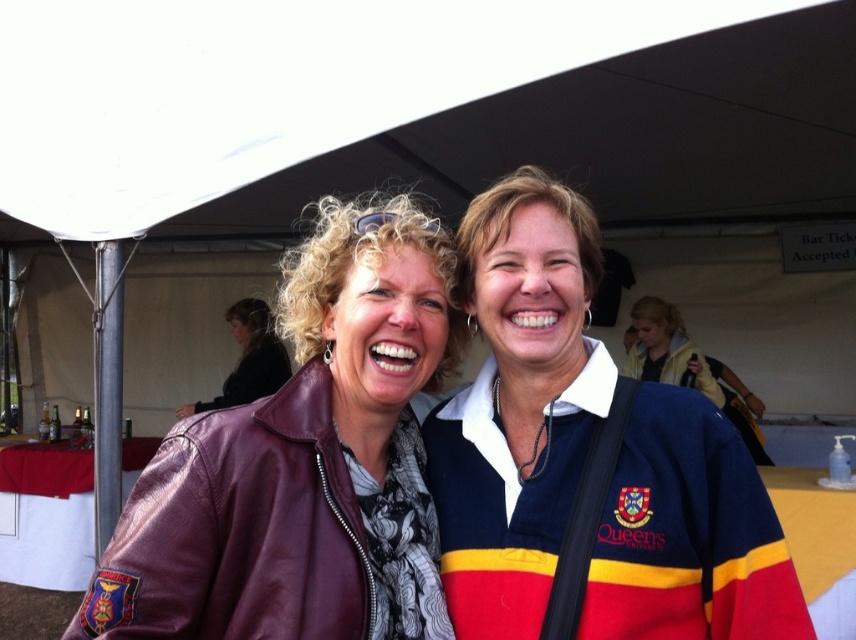
Can you confirm if navy blue jersey at center is thinner than matte leather jacket at center?

In fact, navy blue jersey at center might be wider than matte leather jacket at center.

Describe the element at coordinates (587, 461) in the screenshot. This screenshot has height=640, width=856. I see `navy blue jersey at center` at that location.

Locate an element on the screen. The width and height of the screenshot is (856, 640). navy blue jersey at center is located at coordinates (587, 461).

Is white fabric canopy at upper center to the left of dark brown leather jacket at center from the viewer's perspective?

In fact, white fabric canopy at upper center is to the right of dark brown leather jacket at center.

Is white fabric canopy at upper center positioned in front of dark brown leather jacket at center?

Yes, it is in front of dark brown leather jacket at center.

Between point (657, 54) and point (271, 369), which one is positioned in front?

Positioned in front is point (657, 54).

Find the location of a particular element. The width and height of the screenshot is (856, 640). white fabric canopy at upper center is located at coordinates (417, 106).

Can you confirm if white fabric canopy at upper center is thinner than matte leather jacket at center?

No, white fabric canopy at upper center is not thinner than matte leather jacket at center.

Locate an element on the screen. This screenshot has width=856, height=640. white fabric canopy at upper center is located at coordinates (417, 106).

Which is in front, point (161, 68) or point (423, 604)?

Point (423, 604)

At what (x,y) coordinates should I click in order to perform the action: click on white fabric canopy at upper center. Please return your answer as a coordinate pair (x, y). The height and width of the screenshot is (640, 856). Looking at the image, I should click on point(417,106).